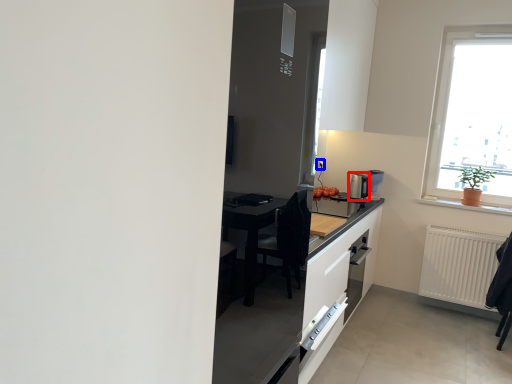
Question: Which of the following is the farthest to the observer, coffee machine (highlighted by a red box) or electric outlet (highlighted by a blue box)?

Choices:
 (A) coffee machine
 (B) electric outlet

Answer: (B)